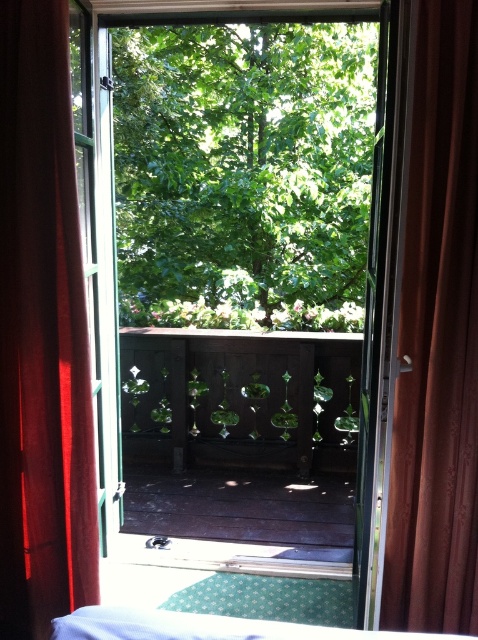
Question: Does red velvet curtain at left appear over white fabric bed at lower center?

Choices:
 (A) no
 (B) yes

Answer: (B)

Question: Is the position of brown velvet curtain at right more distant than that of white fabric bed at lower center?

Choices:
 (A) no
 (B) yes

Answer: (B)

Question: Which point is closer to the camera taking this photo?

Choices:
 (A) (392, 536)
 (B) (234, 636)
 (C) (66, 28)
 (D) (204, 109)

Answer: (B)

Question: Which point appears farthest from the camera in this image?

Choices:
 (A) coord(78,552)
 (B) coord(133,632)

Answer: (A)

Question: Among these objects, which one is farthest from the camera?

Choices:
 (A) green leafy tree at center
 (B) white fabric bed at lower center
 (C) red velvet curtain at left

Answer: (A)

Question: Can you confirm if green leafy tree at center is positioned below red velvet curtain at left?

Choices:
 (A) yes
 (B) no

Answer: (B)